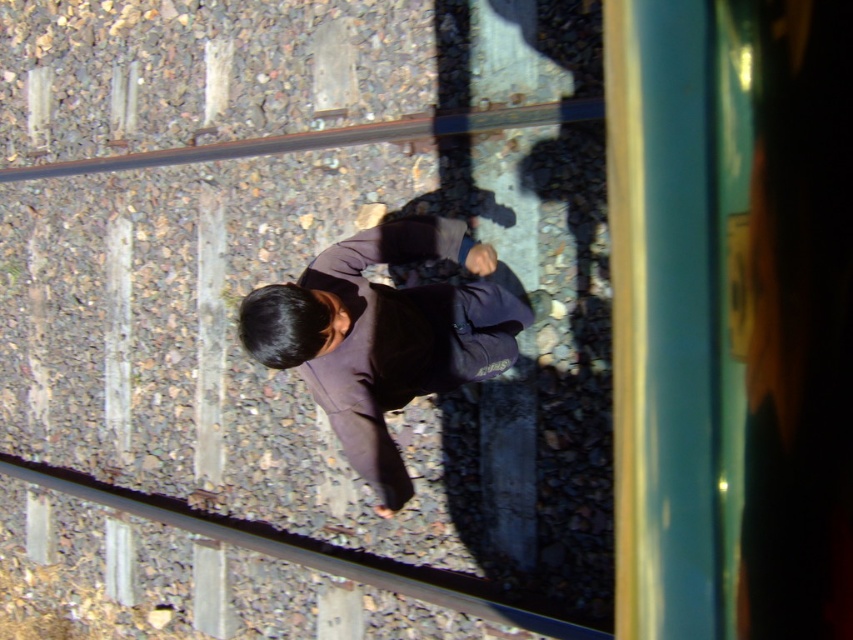
Question: Can you confirm if green glass train window at upper right is wider than metal at bottom?

Choices:
 (A) yes
 (B) no

Answer: (A)

Question: Which is nearer to the green glass train window at upper right?

Choices:
 (A) rusty metal train track at upper center
 (B) dark brown fabric at center

Answer: (A)

Question: Is dark brown fabric at center above metal at bottom?

Choices:
 (A) no
 (B) yes

Answer: (B)

Question: Estimate the real-world distances between objects in this image. Which object is closer to the metal at bottom?

Choices:
 (A) dark brown fabric at center
 (B) rusty metal train track at upper center

Answer: (A)

Question: Is dark brown fabric at center closer to camera compared to rusty metal train track at upper center?

Choices:
 (A) yes
 (B) no

Answer: (A)

Question: Which object is closer to the camera taking this photo?

Choices:
 (A) metal at bottom
 (B) dark brown fabric at center
 (C) rusty metal train track at upper center

Answer: (B)